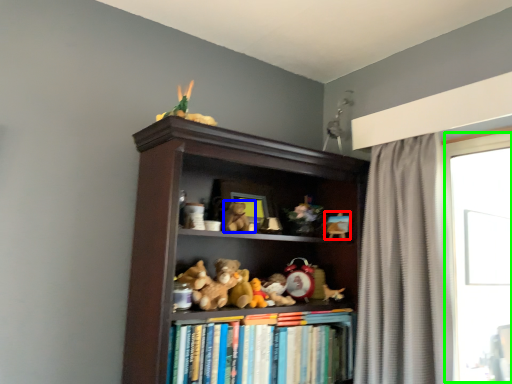
Question: Which object is positioned closest to toy (highlighted by a red box)? Select from animal (highlighted by a blue box) and window (highlighted by a green box).

Choices:
 (A) animal
 (B) window

Answer: (A)